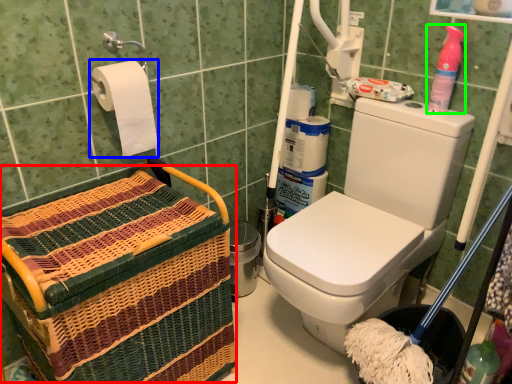
Question: Considering the real-world distances, which object is farthest from basket (highlighted by a red box)? toilet paper (highlighted by a blue box) or cleaning product (highlighted by a green box)?

Choices:
 (A) toilet paper
 (B) cleaning product

Answer: (B)